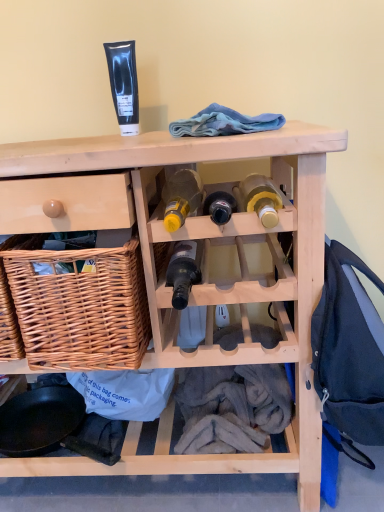
What is the approximate width of woven brown basket at left?

16.47 inches.

This screenshot has height=512, width=384. What do you see at coordinates (81, 307) in the screenshot?
I see `woven brown basket at left` at bounding box center [81, 307].

Find the location of a particular element. Image resolution: width=384 pixels, height=512 pixels. dark blue backpack at right, placed as the 1th clothing when sorted from right to left is located at coordinates (349, 349).

You are a GUI agent. You are given a task and a screenshot of the screen. Output one action in this format:
    pyautogui.click(x=<x>, y=<y>)
    Task: Click on the blue fleece at upper center, positioned as the first clothing in top-to-bottom order
    
    Given the screenshot: What is the action you would take?
    pyautogui.click(x=224, y=123)

What do you see at coordinates (212, 282) in the screenshot?
I see `natural wood wine rack at center` at bounding box center [212, 282].

The height and width of the screenshot is (512, 384). In order to click on black glass tube at upper center in this screenshot , I will do `click(124, 84)`.

Based on the photo, is yellow glass bottle at center, the first bottle when ordered from left to right, shorter than blue fleece at upper center, which appears as the 2th clothing when viewed from the right?

Incorrect, the height of yellow glass bottle at center, the first bottle when ordered from left to right, does not fall short of that of blue fleece at upper center, which appears as the 2th clothing when viewed from the right.

Looking at this image, between yellow glass bottle at center, the third bottle viewed from the right, and blue fleece at upper center, positioned as the first clothing in top-to-bottom order, which one appears on the right side from the viewer's perspective?

blue fleece at upper center, positioned as the first clothing in top-to-bottom order.

Is yellow glass bottle at center, the first bottle when ordered from left to right, aimed at blue fleece at upper center, acting as the first clothing starting from the left?

No, yellow glass bottle at center, the first bottle when ordered from left to right, is not facing towards blue fleece at upper center, acting as the first clothing starting from the left.

From a real-world perspective, is yellow glass bottle at center, the third bottle viewed from the right, above or below blue fleece at upper center, acting as the first clothing starting from the left?

From a real-world perspective, yellow glass bottle at center, the third bottle viewed from the right, is physically below blue fleece at upper center, acting as the first clothing starting from the left.

Is blue fleece at upper center, which appears as the 2th clothing when viewed from the right, behind black glass tube at upper center?

No, the depth of blue fleece at upper center, which appears as the 2th clothing when viewed from the right, is less than that of black glass tube at upper center.

Is blue fleece at upper center, acting as the first clothing starting from the left, wider than black glass tube at upper center?

Correct, the width of blue fleece at upper center, acting as the first clothing starting from the left, exceeds that of black glass tube at upper center.

Is point (229, 126) positioned before point (116, 97)?

Yes, point (229, 126) is in front of point (116, 97).

Is blue fleece at upper center, positioned as the first clothing in top-to-bottom order, facing towards black glass tube at upper center?

No.

Is dark blue backpack at right, placed as the 1th clothing when sorted from right to left, facing away from black glass tube at upper center?

dark blue backpack at right, placed as the 1th clothing when sorted from right to left, is not turned away from black glass tube at upper center.

Based on the photo, is dark blue backpack at right, which is the 2th clothing from left to right, taller or shorter than black glass tube at upper center?

dark blue backpack at right, which is the 2th clothing from left to right, is taller than black glass tube at upper center.

Between dark blue backpack at right, arranged as the 2th clothing when viewed from the top, and black glass tube at upper center, which one is positioned in front?

Positioned in front is dark blue backpack at right, arranged as the 2th clothing when viewed from the top.

From the image's perspective, is dark blue backpack at right, arranged as the 2th clothing when viewed from the top, under black glass tube at upper center?

Indeed, from the image's perspective, dark blue backpack at right, arranged as the 2th clothing when viewed from the top, is shown beneath black glass tube at upper center.

From a real-world perspective, is translucent glass wine bottle at center, which ranks as the 2th bottle in right-to-left order, on natural wood wine rack at center?

Yes.

Is translucent glass wine bottle at center, the second bottle in the left-to-right sequence, not close to natural wood wine rack at center?

They are positioned close to each other.

Is translucent glass wine bottle at center, which ranks as the 2th bottle in right-to-left order, further to camera compared to natural wood wine rack at center?

Yes, it is.

Can you confirm if translucent glass wine bottle at center, the second bottle in the left-to-right sequence, is taller than natural wood wine rack at center?

Incorrect, the height of translucent glass wine bottle at center, the second bottle in the left-to-right sequence, is not larger of that of natural wood wine rack at center.

Is yellow glass bottle at center, the first bottle when ordered from left to right, thinner than translucent glass wine bottle at center, which ranks as the 2th bottle in right-to-left order?

Incorrect, the width of yellow glass bottle at center, the first bottle when ordered from left to right, is not less than that of translucent glass wine bottle at center, which ranks as the 2th bottle in right-to-left order.

Which point is more distant from viewer, (x=181, y=211) or (x=173, y=284)?

Positioned behind is point (x=173, y=284).

Is yellow glass bottle at center, the third bottle viewed from the right, shorter than translucent glass wine bottle at center, which ranks as the 2th bottle in right-to-left order?

Yes.

From the image's perspective, between yellow glass bottle at center, the first bottle when ordered from left to right, and translucent glass wine bottle at center, the second bottle in the left-to-right sequence, which one is located above?

From the image's view, yellow glass bottle at center, the first bottle when ordered from left to right, is above.

Looking at this image, considering the relative positions of translucent glass wine bottle at center, the second bottle in the left-to-right sequence, and black glass tube at upper center in the image provided, is translucent glass wine bottle at center, the second bottle in the left-to-right sequence, to the left or to the right of black glass tube at upper center?

A: In the image, translucent glass wine bottle at center, the second bottle in the left-to-right sequence, appears on the right side of black glass tube at upper center.

From the image's perspective, which is above, translucent glass wine bottle at center, which ranks as the 2th bottle in right-to-left order, or black glass tube at upper center?

black glass tube at upper center, from the image's perspective.

Based on the photo, how distant is translucent glass wine bottle at center, the second bottle in the left-to-right sequence, from black glass tube at upper center?

They are 15.57 inches apart.

Considering the positions of objects matte yellow glass bottle at center, the first bottle from the right, and yellow glass bottle at center, the first bottle when ordered from left to right, in the image provided, who is in front, matte yellow glass bottle at center, the first bottle from the right, or yellow glass bottle at center, the first bottle when ordered from left to right,?

matte yellow glass bottle at center, the first bottle from the right, is closer to the camera.

From a real-world perspective, is matte yellow glass bottle at center, arranged as the 3th bottle when viewed from the left, above or below yellow glass bottle at center, the third bottle viewed from the right?

From a real-world perspective, matte yellow glass bottle at center, arranged as the 3th bottle when viewed from the left, is physically below yellow glass bottle at center, the third bottle viewed from the right.

Considering the positions of objects matte yellow glass bottle at center, the first bottle from the right, and yellow glass bottle at center, the first bottle when ordered from left to right, in the image provided, who is more to the right, matte yellow glass bottle at center, the first bottle from the right, or yellow glass bottle at center, the first bottle when ordered from left to right,?

From the viewer's perspective, matte yellow glass bottle at center, the first bottle from the right, appears more on the right side.

Image resolution: width=384 pixels, height=512 pixels. I want to click on the 2nd bottle below the blue fleece at upper center, placed as the 2th clothing when sorted from bottom to top (from the image's perspective), so click(181, 198).

Locate an element on the screen. The image size is (384, 512). toiletry to the left of blue fleece at upper center, positioned as the first clothing in top-to-bottom order is located at coordinates (x=124, y=84).

When comparing their distances from black glass tube at upper center, does blue fleece at upper center, placed as the 2th clothing when sorted from bottom to top, or dark blue backpack at right, placed as the first clothing when sorted from bottom to top, seem closer?

Among the two, blue fleece at upper center, placed as the 2th clothing when sorted from bottom to top, is located nearer to black glass tube at upper center.

From the image, which object appears to be nearer to dark blue backpack at right, arranged as the 2th clothing when viewed from the top, yellow glass bottle at center, the first bottle when ordered from left to right, or blue fleece at upper center, placed as the 2th clothing when sorted from bottom to top?

yellow glass bottle at center, the first bottle when ordered from left to right, is positioned closer to the anchor dark blue backpack at right, arranged as the 2th clothing when viewed from the top.

Considering their positions, is woven brown basket at left positioned further to blue fleece at upper center, which appears as the 2th clothing when viewed from the right, than natural wood wine rack at center?

The object further to blue fleece at upper center, which appears as the 2th clothing when viewed from the right, is woven brown basket at left.

Estimate the real-world distances between objects in this image. Which object is closer to black glass tube at upper center, woven brown basket at left or translucent glass wine bottle at center, which ranks as the 2th bottle in right-to-left order?

translucent glass wine bottle at center, which ranks as the 2th bottle in right-to-left order, lies closer to black glass tube at upper center than the other object.

Looking at the image, which one is located further to woven brown basket at left, yellow glass bottle at center, the first bottle when ordered from left to right, or natural wood wine rack at center?

The object further to woven brown basket at left is yellow glass bottle at center, the first bottle when ordered from left to right.

When comparing their distances from yellow glass bottle at center, the first bottle when ordered from left to right, does translucent glass wine bottle at center, which ranks as the 2th bottle in right-to-left order, or natural wood wine rack at center seem closer?

Based on the image, translucent glass wine bottle at center, which ranks as the 2th bottle in right-to-left order, appears to be nearer to yellow glass bottle at center, the first bottle when ordered from left to right.

Which object lies nearer to the anchor point dark blue backpack at right, placed as the 1th clothing when sorted from right to left, woven brown basket at left or matte yellow glass bottle at center, arranged as the 3th bottle when viewed from the left?

Based on the image, matte yellow glass bottle at center, arranged as the 3th bottle when viewed from the left, appears to be nearer to dark blue backpack at right, placed as the 1th clothing when sorted from right to left.

Considering their positions, is dark blue backpack at right, placed as the first clothing when sorted from bottom to top, positioned further to yellow glass bottle at center, the first bottle when ordered from left to right, than black glass tube at upper center?

dark blue backpack at right, placed as the first clothing when sorted from bottom to top, lies further to yellow glass bottle at center, the first bottle when ordered from left to right, than the other object.

Image resolution: width=384 pixels, height=512 pixels. I want to click on basket that lies between yellow glass bottle at center, the first bottle when ordered from left to right, and natural wood wine rack at center from top to bottom, so click(81, 307).

You are a GUI agent. You are given a task and a screenshot of the screen. Output one action in this format:
    pyautogui.click(x=<x>, y=<y>)
    Task: Click on the bottle situated between translucent glass wine bottle at center, the second bottle in the left-to-right sequence, and dark blue backpack at right, placed as the first clothing when sorted from bottom to top, from left to right
    
    Given the screenshot: What is the action you would take?
    pyautogui.click(x=261, y=199)

The width and height of the screenshot is (384, 512). In order to click on bottle between woven brown basket at left and translucent glass wine bottle at center, which ranks as the 2th bottle in right-to-left order, in the horizontal direction in this screenshot , I will do `click(181, 198)`.

Locate an element on the screen. The height and width of the screenshot is (512, 384). furniture between woven brown basket at left and translucent glass wine bottle at center, which ranks as the 2th bottle in right-to-left order, from left to right is located at coordinates (212, 282).